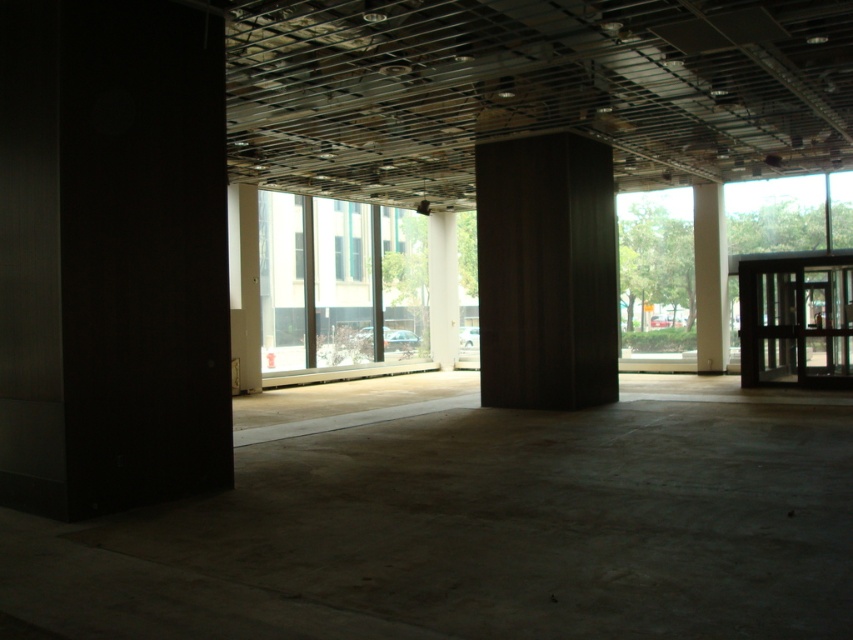
You are standing at the entrance of the construction site and see a point marked at coordinates (x=546, y=273). What object is located at that point?

The point at coordinates (x=546, y=273) indicates a dark wood pillar at center.